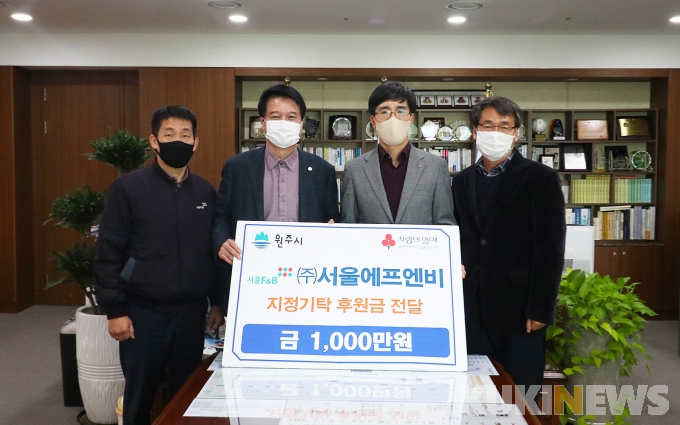
I want to click on lights, so click(460, 23).